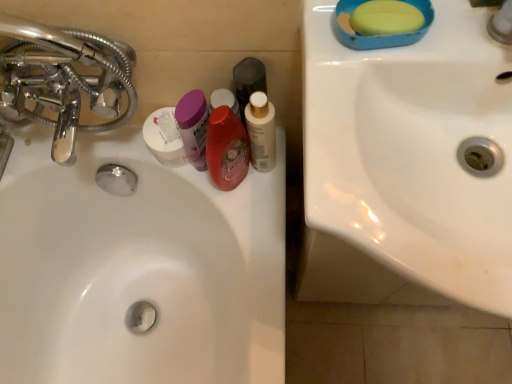
I want to click on free location in front of white glossy mouthwash at center, the 1th mouthwash viewed from the right, so click(259, 231).